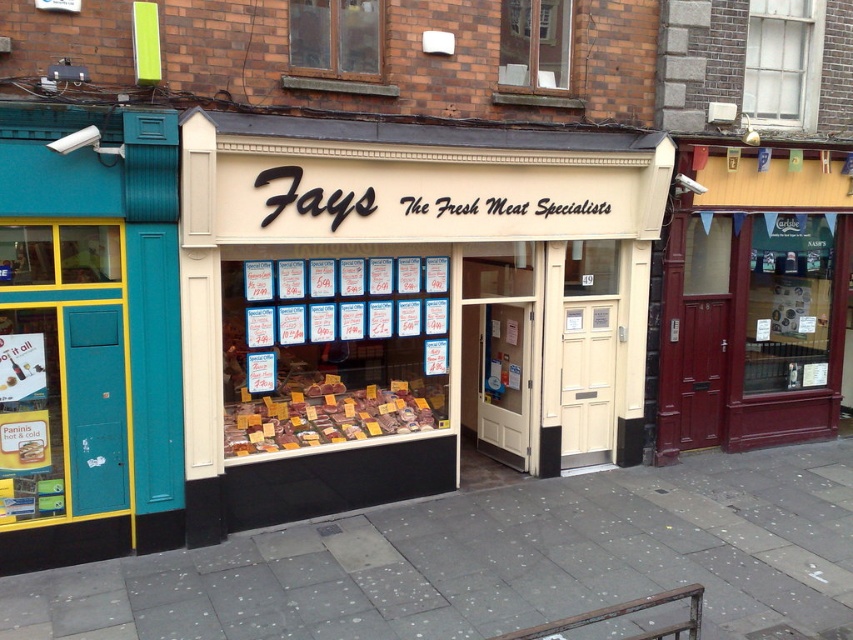
Question: Among these points, which one is nearest to the camera?

Choices:
 (A) (355, 564)
 (B) (409, 429)

Answer: (A)

Question: Among these objects, which one is farthest from the camera?

Choices:
 (A) meat with yellow labels at center
 (B) gray concrete pavement at center

Answer: (A)

Question: Among these objects, which one is nearest to the camera?

Choices:
 (A) gray concrete pavement at center
 (B) meat with yellow labels at center

Answer: (A)

Question: Does gray concrete pavement at center appear over meat with yellow labels at center?

Choices:
 (A) no
 (B) yes

Answer: (A)

Question: Can you confirm if gray concrete pavement at center is positioned below meat with yellow labels at center?

Choices:
 (A) yes
 (B) no

Answer: (A)

Question: Does gray concrete pavement at center lie behind meat with yellow labels at center?

Choices:
 (A) yes
 (B) no

Answer: (B)